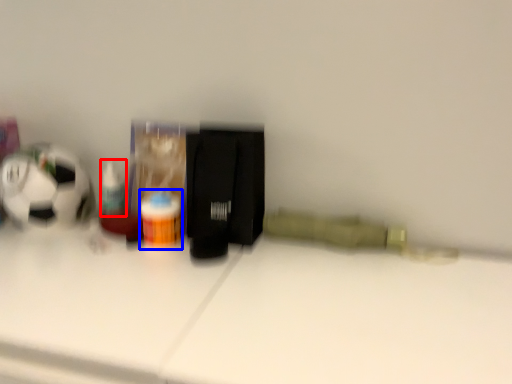
Question: Which object appears closest to the camera in this image, toiletry (highlighted by a red box) or bottle (highlighted by a blue box)?

Choices:
 (A) toiletry
 (B) bottle

Answer: (B)